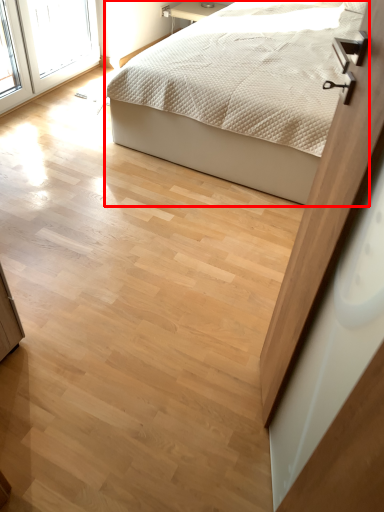
Question: From the image's perspective, what is the correct spatial positioning of bed (annotated by the red box) in reference to screen door?

Choices:
 (A) above
 (B) below

Answer: (A)